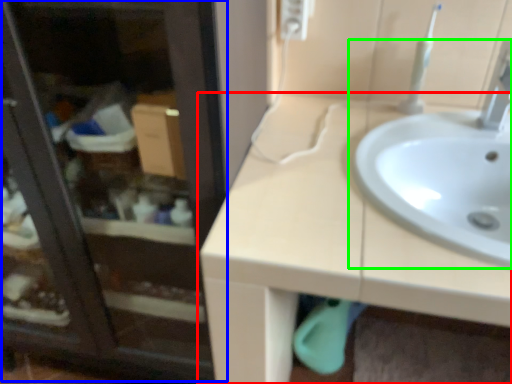
Question: Which is farther away from countertop (highlighted by a red box)? screen door (highlighted by a blue box) or sink (highlighted by a green box)?

Choices:
 (A) screen door
 (B) sink

Answer: (A)